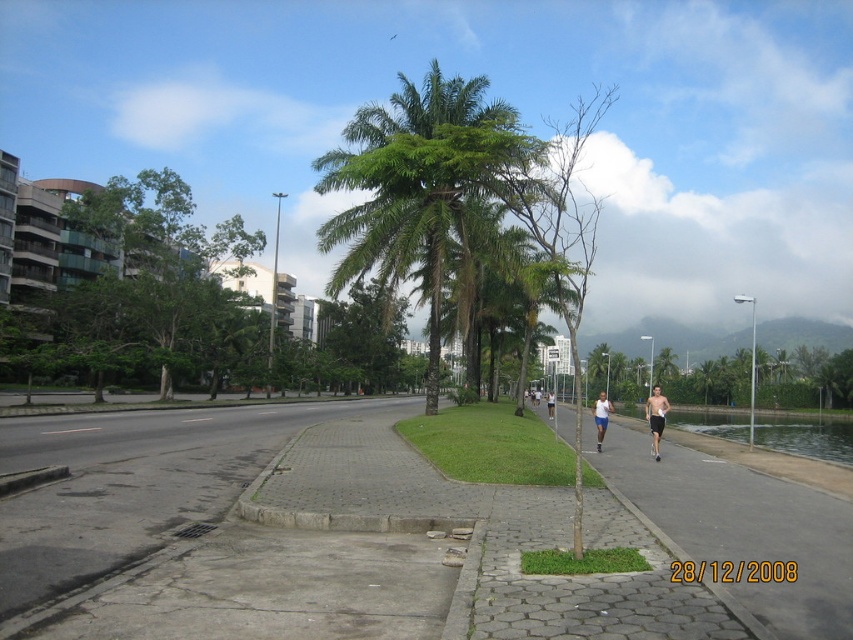
Question: Is green leafy palm tree at center positioned at the back of white cotton shirt at right?

Choices:
 (A) yes
 (B) no

Answer: (B)

Question: Which of these objects is positioned farthest from the green leafy palm tree at center?

Choices:
 (A) white fabric shorts at center-right
 (B) black matte shorts at center-right
 (C) white cotton shirt at right

Answer: (A)

Question: Which is nearer to the green leafy palm tree at center?

Choices:
 (A) white cotton shirt at right
 (B) white fabric shorts at center-right
 (C) black matte shorts at center-right

Answer: (C)

Question: Does white cotton shirt at right appear under white fabric shorts at center-right?

Choices:
 (A) no
 (B) yes

Answer: (A)

Question: Does black matte shorts at center-right appear over white cotton shirt at right?

Choices:
 (A) no
 (B) yes

Answer: (A)

Question: Which object appears farthest from the camera in this image?

Choices:
 (A) white cotton shirt at right
 (B) black matte shorts at center-right
 (C) green leafy palm tree at center

Answer: (A)